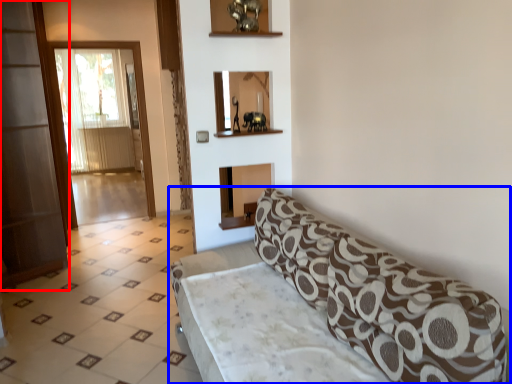
Question: Which point is closer to the camera, screen door (highlighted by a red box) or studio couch (highlighted by a blue box)?

Choices:
 (A) screen door
 (B) studio couch

Answer: (B)